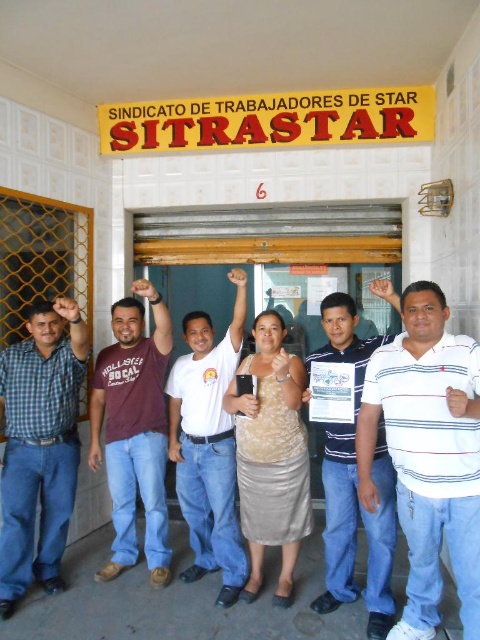
You are a photographer taking a picture of the group in front of the building. You notice the white striped shirt at center and the matte blue jeans at left. Which clothing item is covering part of the other?

The white striped shirt at center is positioned over matte blue jeans at left, so the shirt is covering part of the jeans.

You are a photographer at the scene and need to ensure both the maroon cotton shirt at center and the white cotton shirt at center are clearly visible in your photo. Given their sizes, which shirt might you need to position closer to the camera to ensure visibility?

The maroon cotton shirt at center is smaller than the white cotton shirt at center, so to ensure visibility, you might need to position the maroon cotton shirt at center closer to the camera.

In the scene where a group of six individuals stands in front of a building with a union sign, there are two shirts at the center. Which shirt is positioned to the left when looking at the maroon cotton shirt at center and the white cotton shirt at center?

The maroon cotton shirt at center is positioned to the left of the white cotton shirt at center.